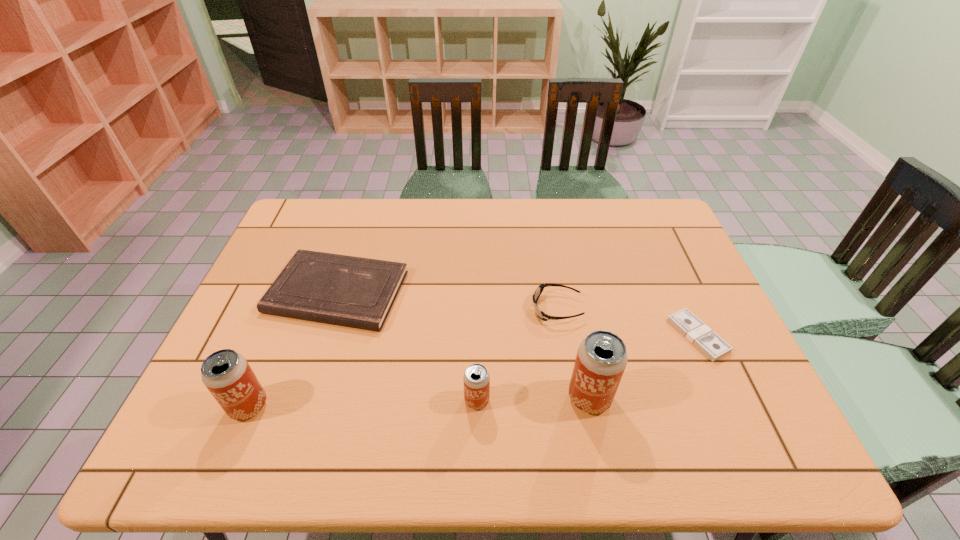
The height and width of the screenshot is (540, 960). I want to click on the leftmost beer can, so click(227, 375).

Locate an element on the screen. the second shortest beer can is located at coordinates point(227,375).

I want to click on the third object from left to right, so click(x=476, y=379).

Identify the location of the shortest beer can. The width and height of the screenshot is (960, 540). (476, 379).

At what (x,y) coordinates should I click in order to perform the action: click on the rightmost beer can. Please return your answer as a coordinate pair (x, y). The image size is (960, 540). Looking at the image, I should click on (601, 359).

Locate an element on the screen. The width and height of the screenshot is (960, 540). the rightmost object is located at coordinates (691, 327).

Identify the location of the shortest object. (691, 327).

Where is `paperback book`? paperback book is located at coordinates (357, 292).

The width and height of the screenshot is (960, 540). Find the location of `sunglasses`. sunglasses is located at coordinates (539, 290).

Identify the location of free space located on the left of the second tallest beer can. (199, 406).